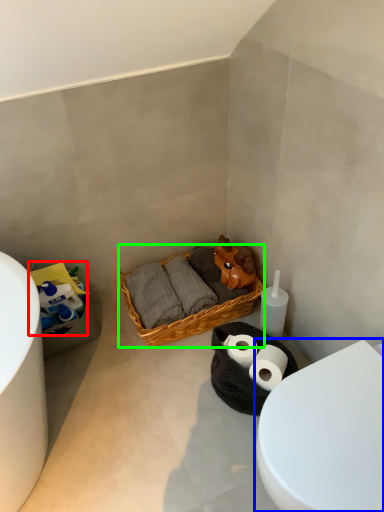
Question: Which object is positioned farthest from toilet paper (highlighted by a red box)? Select from toilet (highlighted by a blue box) and picnic basket (highlighted by a green box).

Choices:
 (A) toilet
 (B) picnic basket

Answer: (A)